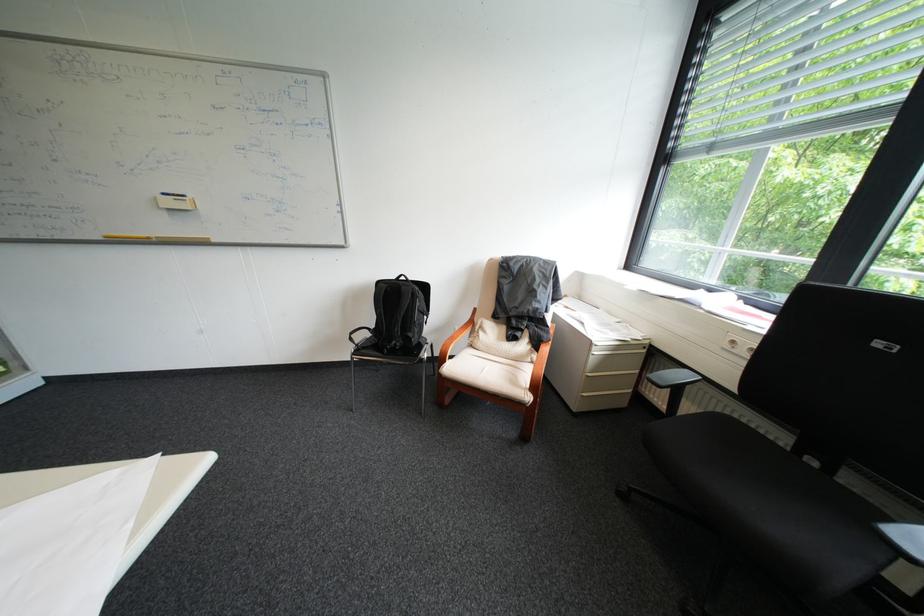
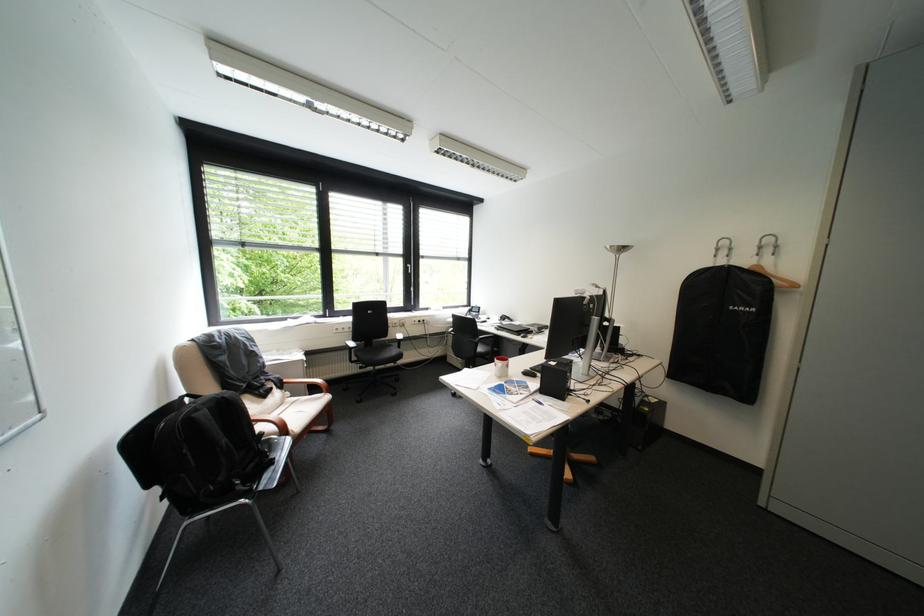
Find the pixel in the second image that matches pixel 415 288 in the first image.

(236, 398)